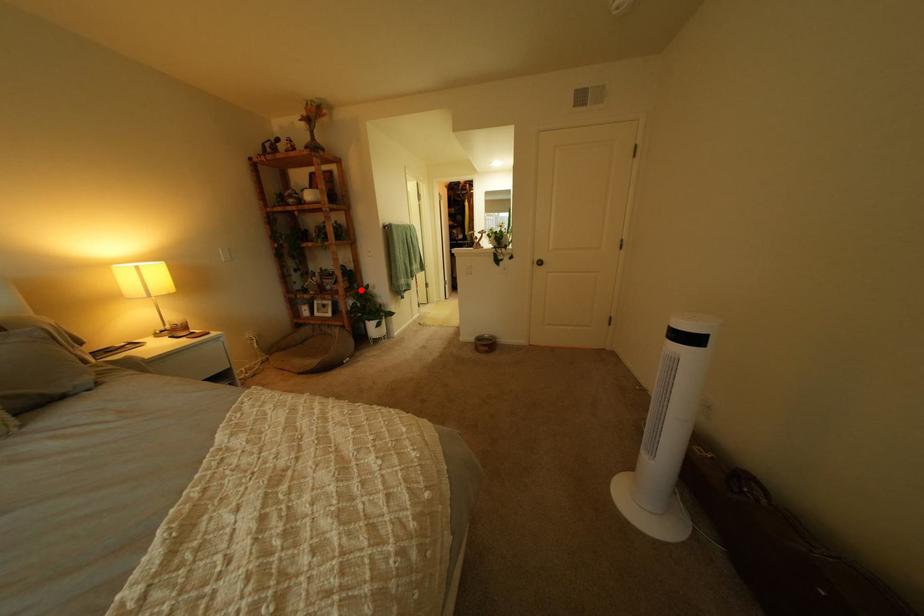
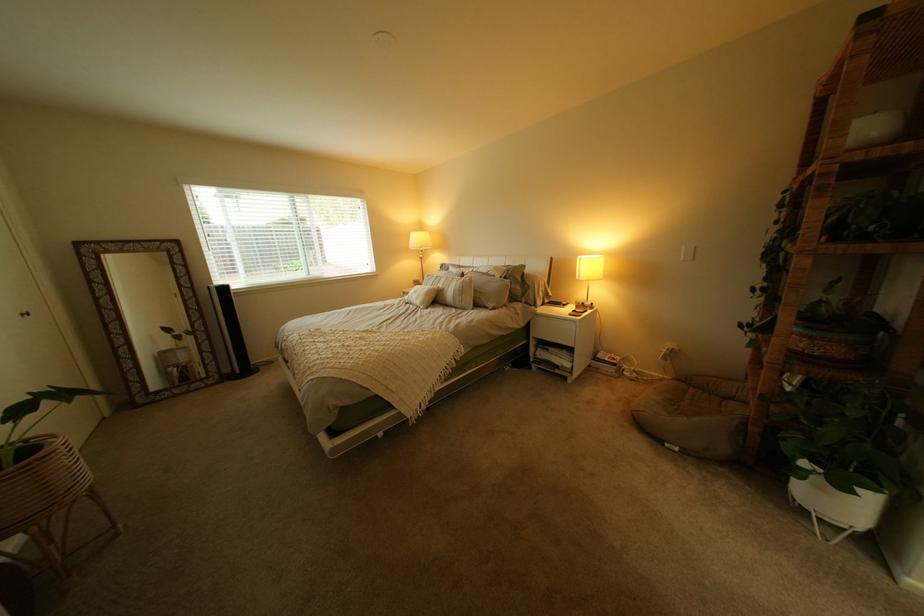
Where in the second image is the point corresponding to the highlighted location from the first image?

(805, 354)